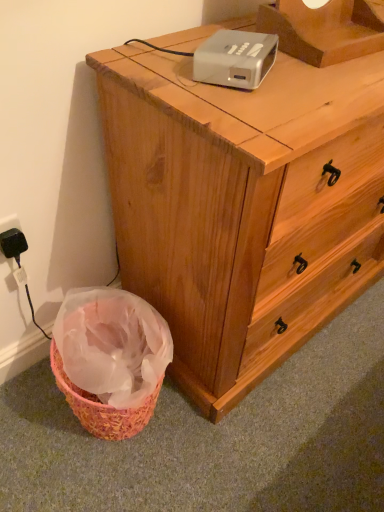
Question: From a real-world perspective, is black plastic electric outlet at lower left on wooden chest of drawers at center?

Choices:
 (A) yes
 (B) no

Answer: (A)

Question: Is black plastic electric outlet at lower left closer to camera compared to wooden chest of drawers at center?

Choices:
 (A) yes
 (B) no

Answer: (B)

Question: Is wooden chest of drawers at center completely or partially inside black plastic electric outlet at lower left?

Choices:
 (A) no
 (B) yes

Answer: (A)

Question: Could you tell me if black plastic electric outlet at lower left is facing wooden chest of drawers at center?

Choices:
 (A) yes
 (B) no

Answer: (B)

Question: From a real-world perspective, is black plastic electric outlet at lower left under wooden chest of drawers at center?

Choices:
 (A) yes
 (B) no

Answer: (B)

Question: From a real-world perspective, is black plastic electric outlet at lower left above or below white plastic projector at upper center?

Choices:
 (A) above
 (B) below

Answer: (B)

Question: Does point (19, 251) appear closer or farther from the camera than point (248, 69)?

Choices:
 (A) closer
 (B) farther

Answer: (B)

Question: Is black plastic electric outlet at lower left inside or outside of white plastic projector at upper center?

Choices:
 (A) outside
 (B) inside

Answer: (A)

Question: From the image's perspective, is black plastic electric outlet at lower left positioned above or below white plastic projector at upper center?

Choices:
 (A) below
 (B) above

Answer: (A)

Question: Based on their sizes in the image, would you say black plastic electric outlet at lower left is bigger or smaller than wooden chest of drawers at center?

Choices:
 (A) small
 (B) big

Answer: (A)

Question: Considering the positions of black plastic electric outlet at lower left and wooden chest of drawers at center in the image, is black plastic electric outlet at lower left taller or shorter than wooden chest of drawers at center?

Choices:
 (A) tall
 (B) short

Answer: (B)

Question: Is black plastic electric outlet at lower left in front of or behind wooden chest of drawers at center in the image?

Choices:
 (A) front
 (B) behind

Answer: (B)

Question: In the image, is black plastic electric outlet at lower left on the left side or the right side of wooden chest of drawers at center?

Choices:
 (A) left
 (B) right

Answer: (A)

Question: From the image's perspective, is wooden chest of drawers at center positioned above or below white plastic projector at upper center?

Choices:
 (A) above
 (B) below

Answer: (B)

Question: From a real-world perspective, is wooden chest of drawers at center positioned above or below white plastic projector at upper center?

Choices:
 (A) above
 (B) below

Answer: (B)